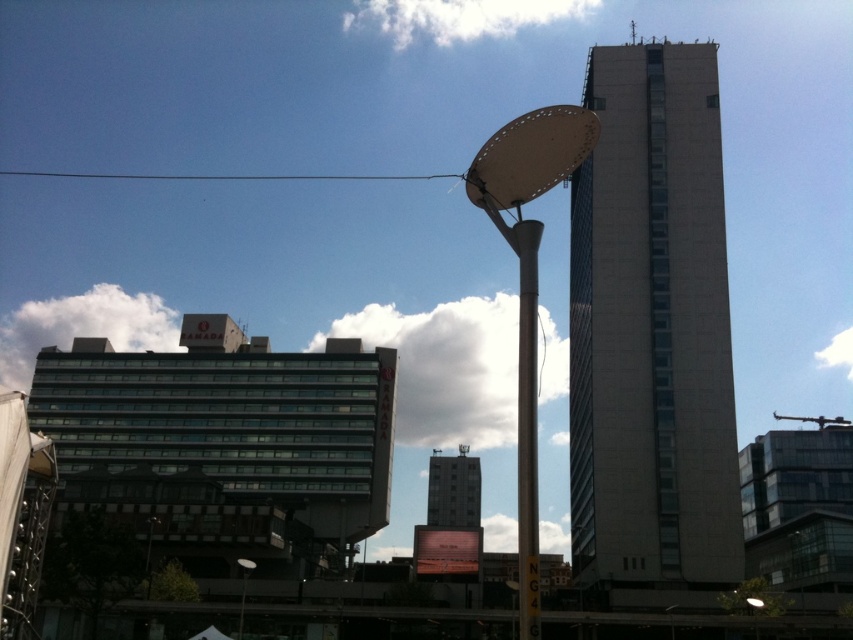
Is the position of metallic pole at lower left less distant than that of metallic satellite dish at upper center?

Yes, metallic pole at lower left is closer to the viewer.

Who is lower down, metallic pole at lower left or metallic satellite dish at upper center?

Positioned lower is metallic pole at lower left.

This screenshot has width=853, height=640. Find the location of `metallic pole at lower left`. metallic pole at lower left is located at coordinates (149, 548).

In order to click on metallic pole at lower left in this screenshot , I will do `click(149, 548)`.

Who is positioned more to the right, silver metallic pole at center or gray concrete tower at center?

silver metallic pole at center is more to the right.

Can you confirm if silver metallic pole at center is bigger than gray concrete tower at center?

Yes.

Which is in front, point (525, 429) or point (456, 499)?

Point (525, 429) is more forward.

Identify the location of silver metallic pole at center. This screenshot has height=640, width=853. (527, 426).

Does gray concrete building at center appear on the right side of metallic pole at lower left?

Correct, you'll find gray concrete building at center to the right of metallic pole at lower left.

The width and height of the screenshot is (853, 640). Describe the element at coordinates (651, 330) in the screenshot. I see `gray concrete building at center` at that location.

Who is more forward, (697,67) or (148,545)?

Point (148,545) is more forward.

The image size is (853, 640). In order to click on gray concrete building at center in this screenshot , I will do `click(651, 330)`.